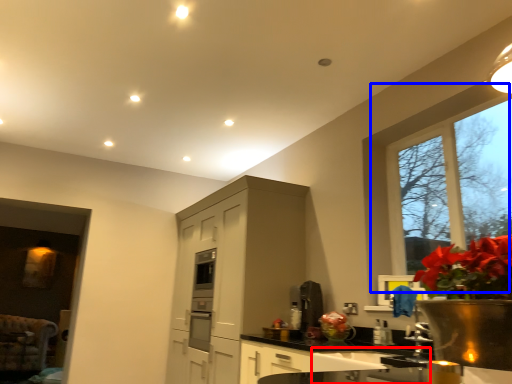
Question: Among these objects, which one is nearest to the camera, sink (highlighted by a red box) or window (highlighted by a blue box)?

Choices:
 (A) sink
 (B) window

Answer: (A)